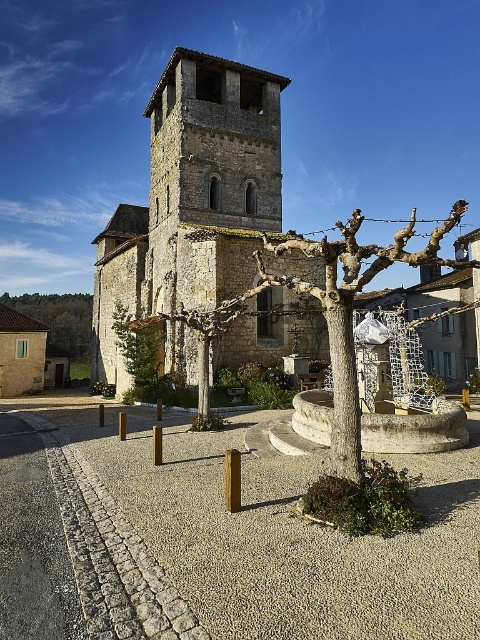
Question: Is bare wood tree at center to the left of green leafy tree at lower left from the viewer's perspective?

Choices:
 (A) yes
 (B) no

Answer: (B)

Question: Based on their relative distances, which object is farther from the bare wood tree at center?

Choices:
 (A) green leafy tree at center
 (B) stone tower at center

Answer: (A)

Question: Observing the image, what is the correct spatial positioning of green leafy tree at lower left in reference to green leafy tree at center?

Choices:
 (A) left
 (B) right

Answer: (A)

Question: Estimate the real-world distances between objects in this image. Which object is closer to the bare wood tree at center?

Choices:
 (A) stone tower at center
 (B) green leafy tree at lower left

Answer: (A)

Question: Can you confirm if stone tower at center is bigger than bare wood tree at center?

Choices:
 (A) no
 (B) yes

Answer: (A)

Question: Estimate the real-world distances between objects in this image. Which object is closer to the green leafy tree at center?

Choices:
 (A) green leafy tree at lower left
 (B) stone tower at center

Answer: (B)